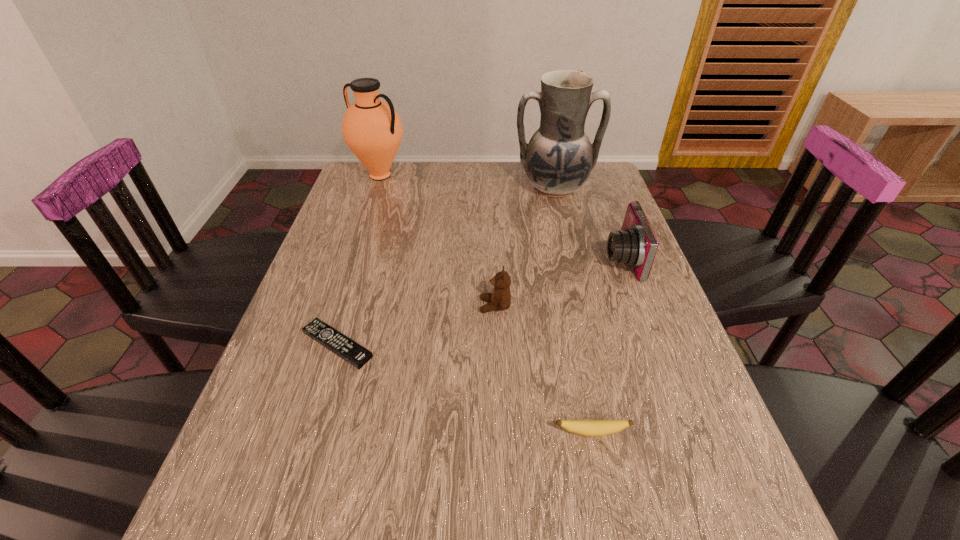
Where is `free space between the fifth farthest object and the second shortest object`? The width and height of the screenshot is (960, 540). free space between the fifth farthest object and the second shortest object is located at coordinates (x=465, y=388).

Image resolution: width=960 pixels, height=540 pixels. I want to click on unoccupied area between the camera and the left pitcher, so click(x=500, y=217).

This screenshot has height=540, width=960. In order to click on unoccupied area between the banana and the second nearest object in this screenshot , I will do `click(465, 388)`.

I want to click on empty space that is in between the left pitcher and the right pitcher, so click(x=468, y=182).

The height and width of the screenshot is (540, 960). Find the location of `empty space that is in between the camera and the right pitcher`. empty space that is in between the camera and the right pitcher is located at coordinates (588, 224).

The image size is (960, 540). Find the location of `vacant region between the fifth tallest object and the left pitcher`. vacant region between the fifth tallest object and the left pitcher is located at coordinates (486, 304).

Locate an element on the screen. free space between the nearest object and the left pitcher is located at coordinates (486, 304).

Locate an element on the screen. The image size is (960, 540). free space between the third object from left to right and the left pitcher is located at coordinates (438, 241).

The image size is (960, 540). I want to click on free area in between the third farthest object and the banana, so click(607, 345).

You are a GUI agent. You are given a task and a screenshot of the screen. Output one action in this format:
    pyautogui.click(x=<x>, y=<y>)
    Task: Click on the vacant space in between the third farthest object and the third nearest object
    
    Given the screenshot: What is the action you would take?
    pyautogui.click(x=558, y=282)